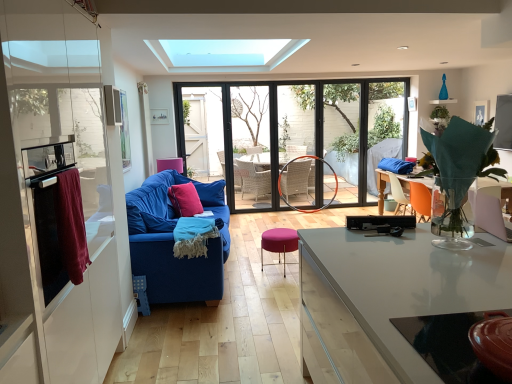
Measure the distance between transparent glass door at center and camera.

They are 6.53 meters apart.

What is the approximate width of transparent glass door at center?

transparent glass door at center is 20.01 centimeters in width.

Identify the location of pink fabric armchair at center. (170, 164).

The height and width of the screenshot is (384, 512). What do you see at coordinates (170, 164) in the screenshot?
I see `pink fabric armchair at center` at bounding box center [170, 164].

Where is `purple fabric stool at center`? purple fabric stool at center is located at coordinates coord(279,243).

The height and width of the screenshot is (384, 512). What do you see at coordinates (57, 215) in the screenshot?
I see `stainless steel oven at left, marked as the second appliance in a right-to-left arrangement` at bounding box center [57, 215].

Where is `transparent glass window at center`? This screenshot has height=384, width=512. transparent glass window at center is located at coordinates (288, 132).

The width and height of the screenshot is (512, 384). Describe the element at coordinates (185, 200) in the screenshot. I see `pink velvet throw pillow at center` at that location.

At what (x,y) coordinates should I click in order to perform the action: click on transparent glass door at center. Please return your answer as a coordinate pair (x, y). Looking at the image, I should click on (250, 146).

Does transparent glass door at center touch maroon fabric towel at left?

No, transparent glass door at center is not making contact with maroon fabric towel at left.

From a real-world perspective, is transparent glass door at center physically located above or below maroon fabric towel at left?

From a real-world perspective, transparent glass door at center is physically below maroon fabric towel at left.

From the image's perspective, is transparent glass door at center under maroon fabric towel at left?

No.

Visually, is transparent glass door at center positioned to the left or to the right of maroon fabric towel at left?

From the image, it's evident that transparent glass door at center is to the right of maroon fabric towel at left.

From the image's perspective, which is above, pink velvet pillow at center or maroon fabric towel at left?

pink velvet pillow at center is shown above in the image.

Considering their positions, is pink velvet pillow at center located in front of or behind maroon fabric towel at left?

Visually, pink velvet pillow at center is located behind maroon fabric towel at left.

Would you consider pink velvet pillow at center to be distant from maroon fabric towel at left?

Absolutely, pink velvet pillow at center is distant from maroon fabric towel at left.

Is pink velvet pillow at center shorter than maroon fabric towel at left?

No.

Which of these two, stainless steel oven at left, the 1th appliance in the front-to-back sequence, or transparent glass table at lower right, is bigger?

stainless steel oven at left, the 1th appliance in the front-to-back sequence, is bigger.

Are stainless steel oven at left, the 2th appliance positioned from the bottom, and transparent glass table at lower right beside each other?

They are not placed beside each other.

Which object is closer to the camera, stainless steel oven at left, positioned as the first appliance in top-to-bottom order, or transparent glass table at lower right?

Positioned in front is transparent glass table at lower right.

Based on the photo, can you tell me how much stainless steel oven at left, marked as the second appliance in a right-to-left arrangement, and transparent glass table at lower right differ in facing direction?

stainless steel oven at left, marked as the second appliance in a right-to-left arrangement, and transparent glass table at lower right are facing 180 degrees away from each other.

Is point (157, 160) positioned after point (175, 173)?

Yes, point (157, 160) is farther from viewer.

Is pink velvet pillow at center a part of pink fabric armchair at center?

No, pink velvet pillow at center is not a part of pink fabric armchair at center.

Does pink fabric armchair at center have a larger size compared to pink velvet pillow at center?

Incorrect, pink fabric armchair at center is not larger than pink velvet pillow at center.

Between pink fabric armchair at center and pink velvet pillow at center, which one appears on the right side from the viewer's perspective?

From the viewer's perspective, pink velvet pillow at center appears more on the right side.

Is maroon fabric towel at left in contact with transparent glass table at lower right?

No, maroon fabric towel at left is not touching transparent glass table at lower right.

Is maroon fabric towel at left facing away from transparent glass table at lower right?

No, transparent glass table at lower right is not at the back of maroon fabric towel at left.

Does point (58, 237) appear closer or farther from the camera than point (438, 359)?

Point (58, 237) appears to be farther away from the viewer than point (438, 359).

Who is taller, maroon fabric towel at left or transparent glass table at lower right?

Standing taller between the two is maroon fabric towel at left.

What's the angular difference between pink fabric armchair at center and transparent glass door at center's facing directions?

There is a 80-degree angle between the facing directions of pink fabric armchair at center and transparent glass door at center.

Considering the relative sizes of pink fabric armchair at center and transparent glass door at center in the image provided, is pink fabric armchair at center shorter than transparent glass door at center?

Correct, pink fabric armchair at center is not as tall as transparent glass door at center.

Which is in front, point (170, 163) or point (256, 86)?

Point (170, 163)

Are pink fabric armchair at center and transparent glass door at center making contact?

pink fabric armchair at center is not next to transparent glass door at center, and they're not touching.

Considering the sizes of objects pink fabric armchair at center and stainless steel oven at left, placed as the 1th appliance when sorted from left to right, in the image provided, who is shorter, pink fabric armchair at center or stainless steel oven at left, placed as the 1th appliance when sorted from left to right,?

With less height is pink fabric armchair at center.

Considering the positions of objects pink fabric armchair at center and stainless steel oven at left, the 1th appliance in the front-to-back sequence, in the image provided, who is more to the left, pink fabric armchair at center or stainless steel oven at left, the 1th appliance in the front-to-back sequence,?

From the viewer's perspective, pink fabric armchair at center appears more on the left side.

Can you confirm if pink fabric armchair at center is wider than stainless steel oven at left, positioned as the first appliance in top-to-bottom order?

Yes, pink fabric armchair at center is wider than stainless steel oven at left, positioned as the first appliance in top-to-bottom order.

Image resolution: width=512 pixels, height=384 pixels. I want to click on glass door on the right of maroon fabric towel at left, so click(250, 146).

You are a GUI agent. You are given a task and a screenshot of the screen. Output one action in this format:
    pyautogui.click(x=<x>, y=<y>)
    Task: Click on the laundry in front of the pink velvet pillow at center
    The width and height of the screenshot is (512, 384).
    Given the screenshot: What is the action you would take?
    pyautogui.click(x=71, y=224)

Considering their positions, is maroon fabric towel at left positioned closer to purple fabric stool at center than stainless steel oven at left, positioned as the first appliance in top-to-bottom order?

The object closer to purple fabric stool at center is maroon fabric towel at left.

Based on the photo, from the image, which object appears to be nearer to transparent glass door at center, velvet blue sofa at center left or pink velvet pillow at center?

Based on the image, pink velvet pillow at center appears to be nearer to transparent glass door at center.

Which object lies nearer to the anchor point transparent glass window at center, orange plastic chair at right or transparent glass door at center?

The object closer to transparent glass window at center is transparent glass door at center.

From the picture: When comparing their distances from black plastic tv at center, acting as the 2th appliance starting from the front, does purple fabric stool at center or velvet blue sofa at center left seem closer?

Based on the image, purple fabric stool at center appears to be nearer to black plastic tv at center, acting as the 2th appliance starting from the front.

From the picture: Considering their positions, is blue textured blanket at center positioned closer to transparent glass table at lower right than velvet blue sofa at center left?

blue textured blanket at center is closer to transparent glass table at lower right.

Which object lies further to the anchor point orange plastic chair at right, transparent glass table at lower right or pink velvet throw pillow at center?

transparent glass table at lower right.

Considering their positions, is blue textured blanket at center positioned further to maroon fabric towel at left than velvet blue sofa at center left?

velvet blue sofa at center left is further to maroon fabric towel at left.

Considering their positions, is transparent glass window at center positioned closer to pink fabric armchair at center than maroon fabric towel at left?

transparent glass window at center is closer to pink fabric armchair at center.

The width and height of the screenshot is (512, 384). I want to click on studio couch between maroon fabric towel at left and transparent glass window at center along the z-axis, so click(x=173, y=242).

This screenshot has height=384, width=512. Find the location of `studio couch between transparent glass table at lower right and pink velvet throw pillow at center in the front-back direction`. studio couch between transparent glass table at lower right and pink velvet throw pillow at center in the front-back direction is located at coordinates (173, 242).

This screenshot has width=512, height=384. In order to click on material between transparent glass table at lower right and pink velvet pillow at center from front to back in this screenshot , I will do `click(193, 236)`.

Identify the location of pillow located between black plastic tv at center, the 2th appliance positioned from the left, and transparent glass door at center in the depth direction. (205, 190).